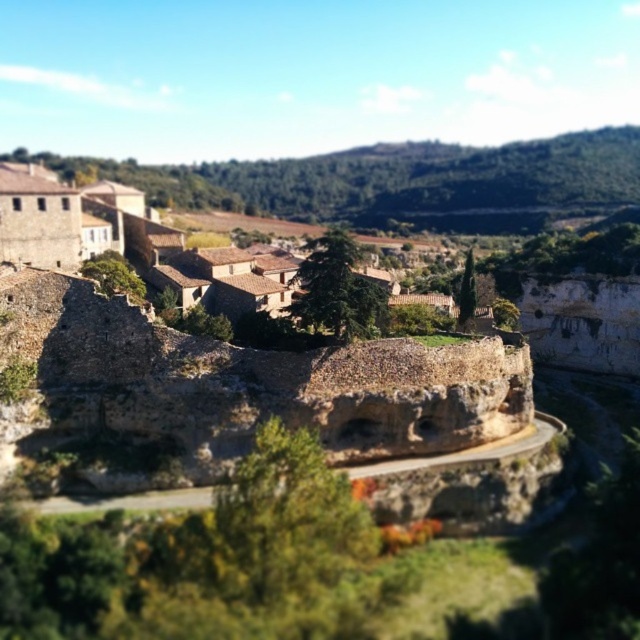
Between point (77, 401) and point (173, 284), which one is positioned in front?

Point (77, 401)

Which is more to the left, brown rough stone wall at center or brown stone village at upper left?

brown stone village at upper left

Measure the distance between brown rough stone wall at center and camera.

A distance of 71.24 meters exists between brown rough stone wall at center and camera.

Identify the location of brown rough stone wall at center. The height and width of the screenshot is (640, 640). click(252, 381).